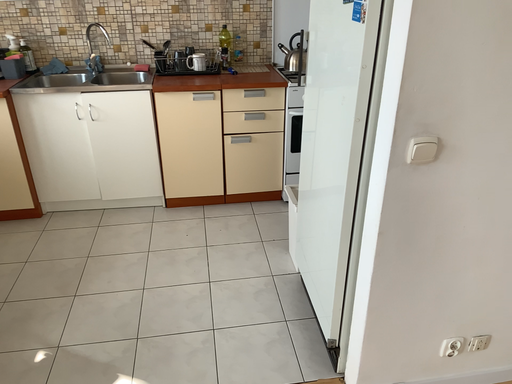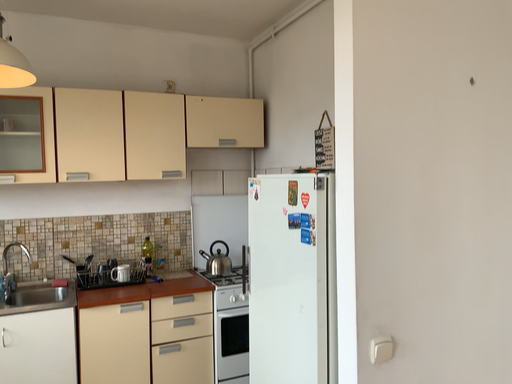
Question: How did the camera likely rotate when shooting the video?

Choices:
 (A) rotated right
 (B) rotated left

Answer: (A)